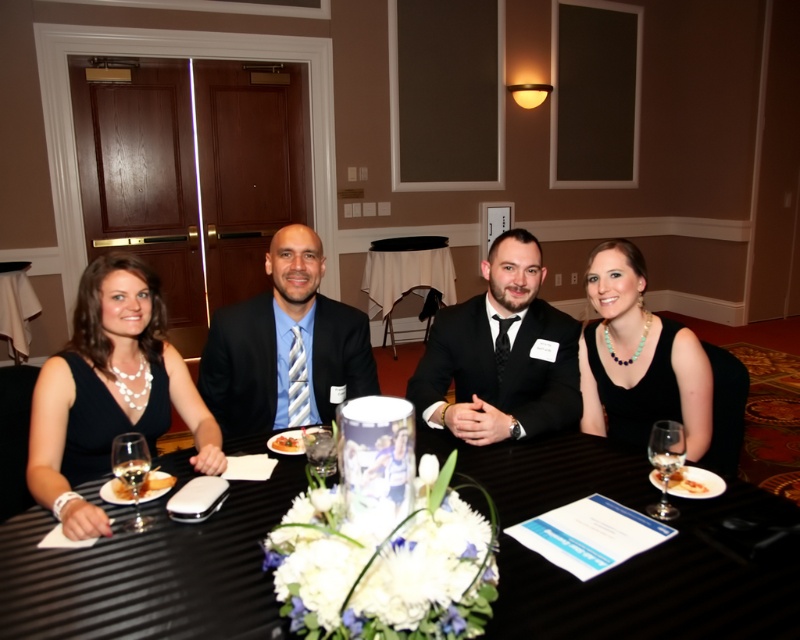
Does transparent glass wine glass at lower right have a greater width compared to golden brown bread at center?

In fact, transparent glass wine glass at lower right might be narrower than golden brown bread at center.

Describe the element at coordinates (666, 461) in the screenshot. I see `transparent glass wine glass at lower right` at that location.

Which is behind, point (668, 509) or point (284, 440)?

Positioned behind is point (284, 440).

Image resolution: width=800 pixels, height=640 pixels. I want to click on transparent glass wine glass at lower right, so point(666,461).

Who is positioned more to the right, matte black dress at left or matte black suit at center?

matte black suit at center is more to the right.

Is point (88, 316) farther from viewer compared to point (276, 284)?

No, (88, 316) is closer to viewer.

Between point (141, 326) and point (324, 365), which one is positioned in front?

Point (141, 326)

Identify the location of matte black dress at left. (110, 392).

Is transparent glass wine glass at lower right wider than white porcelain plate at lower left?

Incorrect, transparent glass wine glass at lower right's width does not surpass white porcelain plate at lower left's.

Who is shorter, transparent glass wine glass at lower right or white porcelain plate at lower left?

Standing shorter between the two is white porcelain plate at lower left.

Where is `transparent glass wine glass at lower right`? The width and height of the screenshot is (800, 640). transparent glass wine glass at lower right is located at coordinates (666, 461).